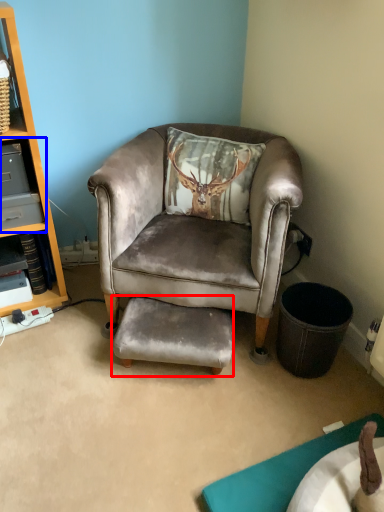
Question: Which object appears closest to the camera in this image, footrest (highlighted by a red box) or shelf (highlighted by a blue box)?

Choices:
 (A) footrest
 (B) shelf

Answer: (A)